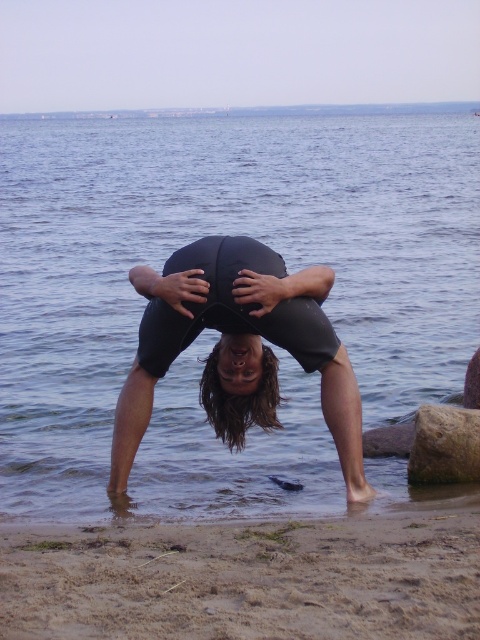
You are a lifeguard observing the scene from a tower. You notice the blue water at center and the black neoprene wetsuit at center. Which object is positioned higher in the image?

The blue water at center is located above the black neoprene wetsuit at center, so the blue water at center is higher in the image.